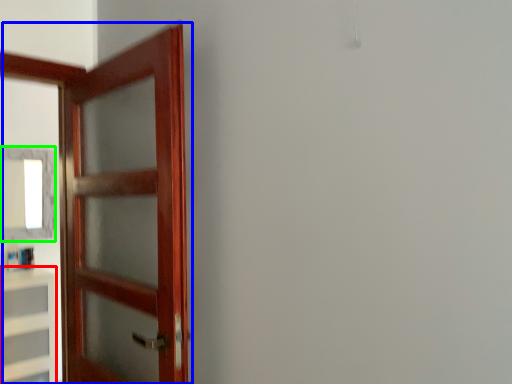
Question: Which is farther away from cabinetry (highlighted by a red box)? door (highlighted by a blue box) or mirror (highlighted by a green box)?

Choices:
 (A) door
 (B) mirror

Answer: (A)